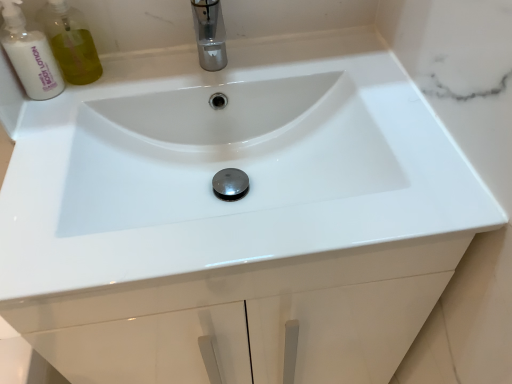
Question: In the image, is polished chrome tap at upper center positioned in front of or behind white lotion at upper left?

Choices:
 (A) behind
 (B) front

Answer: (B)

Question: Considering the positions of polished chrome tap at upper center and white lotion at upper left in the image, is polished chrome tap at upper center wider or thinner than white lotion at upper left?

Choices:
 (A) wide
 (B) thin

Answer: (A)

Question: From their relative heights in the image, would you say polished chrome tap at upper center is taller or shorter than white lotion at upper left?

Choices:
 (A) short
 (B) tall

Answer: (A)

Question: Would you say white lotion at upper left is to the left or to the right of polished chrome tap at upper center in the picture?

Choices:
 (A) right
 (B) left

Answer: (B)

Question: Considering the positions of white lotion at upper left and polished chrome tap at upper center in the image, is white lotion at upper left bigger or smaller than polished chrome tap at upper center?

Choices:
 (A) big
 (B) small

Answer: (B)

Question: Is white lotion at upper left situated inside polished chrome tap at upper center or outside?

Choices:
 (A) inside
 (B) outside

Answer: (B)

Question: From the image's perspective, is white lotion at upper left positioned above or below polished chrome tap at upper center?

Choices:
 (A) above
 (B) below

Answer: (B)